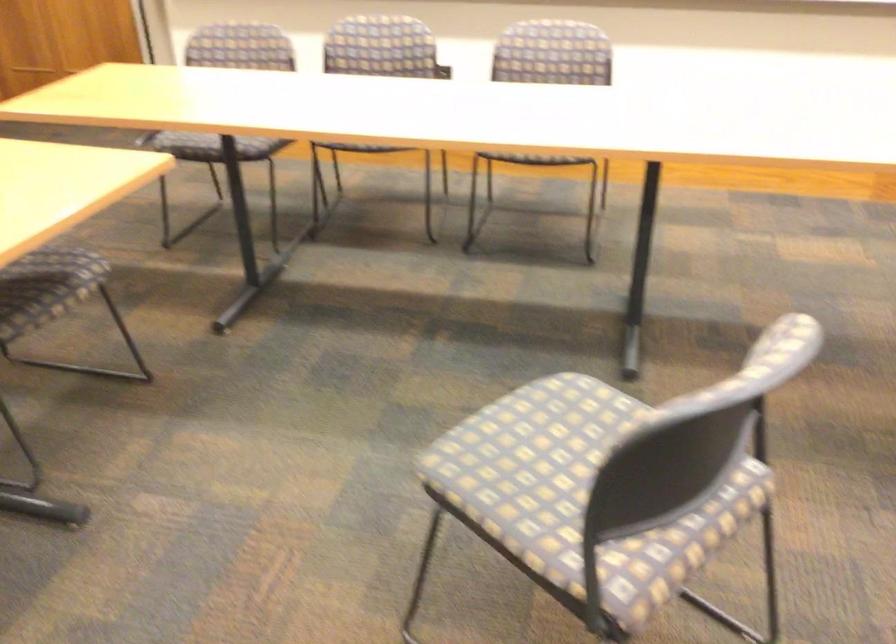
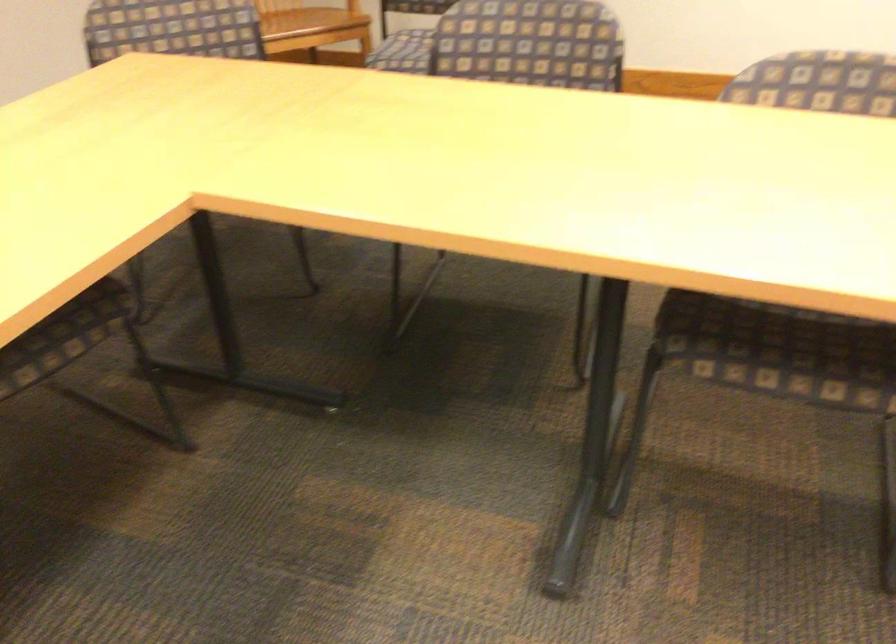
The images are taken continuously from a first-person perspective. In which direction is your viewpoint rotating?

The camera's rotation is toward left-down.